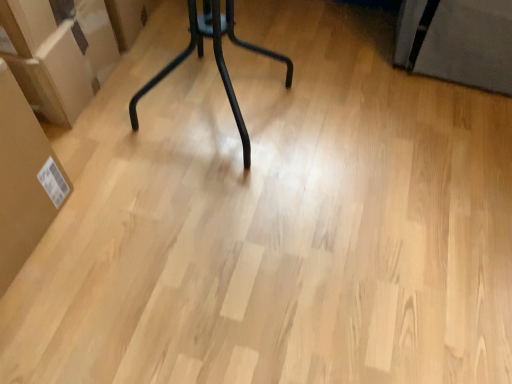
Question: Is matte brown cardboard at left, placed as the 2th cardboard box when sorted from front to back, inside the boundaries of brown cardboard box at left, placed as the first cardboard box when sorted from front to back, or outside?

Choices:
 (A) outside
 (B) inside

Answer: (A)

Question: Is matte brown cardboard at left, which ranks as the 2th cardboard box in bottom-to-top order, in front of or behind brown cardboard box at left, which ranks as the 1th cardboard box in bottom-to-top order, in the image?

Choices:
 (A) front
 (B) behind

Answer: (B)

Question: From a real-world perspective, is matte brown cardboard at left, which ranks as the 2th cardboard box in bottom-to-top order, above or below brown cardboard box at left, placed as the first cardboard box when sorted from front to back?

Choices:
 (A) above
 (B) below

Answer: (B)

Question: From the image's perspective, is brown cardboard box at left, placed as the first cardboard box when sorted from front to back, positioned above or below matte brown cardboard at left, which is counted as the 1th cardboard box, starting from the back?

Choices:
 (A) above
 (B) below

Answer: (B)

Question: Relative to matte brown cardboard at left, which is counted as the 1th cardboard box, starting from the back, is brown cardboard box at left, placed as the first cardboard box when sorted from front to back, in front or behind?

Choices:
 (A) front
 (B) behind

Answer: (A)

Question: Is point (4, 99) closer or farther from the camera than point (62, 74)?

Choices:
 (A) farther
 (B) closer

Answer: (B)

Question: Considering the positions of brown cardboard box at left, which ranks as the 1th cardboard box in bottom-to-top order, and matte brown cardboard at left, which is counted as the 1th cardboard box, starting from the back, in the image, is brown cardboard box at left, which ranks as the 1th cardboard box in bottom-to-top order, taller or shorter than matte brown cardboard at left, which is counted as the 1th cardboard box, starting from the back,?

Choices:
 (A) short
 (B) tall

Answer: (B)